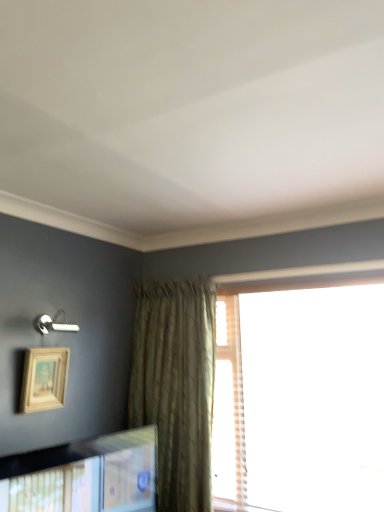
At what (x,y) coordinates should I click in order to perform the action: click on translucent plaid curtain at right. Please return your answer as a coordinate pair (x, y). Looking at the image, I should click on (300, 399).

Identify the location of wooden picture frame at lower left, which appears as the second picture frame when viewed from the top. (85, 475).

Based on their sizes in the image, would you say wooden picture frame at upper left, positioned as the first picture frame in top-to-bottom order, is bigger or smaller than wooden picture frame at lower left, which appears as the second picture frame when viewed from the top?

In the image, wooden picture frame at upper left, positioned as the first picture frame in top-to-bottom order, appears to be smaller than wooden picture frame at lower left, which appears as the second picture frame when viewed from the top.

Are wooden picture frame at upper left, positioned as the first picture frame in top-to-bottom order, and wooden picture frame at lower left, which appears as the second picture frame when viewed from the top, beside each other?

No, wooden picture frame at upper left, positioned as the first picture frame in top-to-bottom order, is not beside wooden picture frame at lower left, which appears as the second picture frame when viewed from the top.

Considering the positions of points (41, 381) and (93, 502), is point (41, 381) farther from camera compared to point (93, 502)?

Yes, it is.

Is wooden picture frame at upper left, positioned as the first picture frame in top-to-bottom order, shorter than wooden picture frame at lower left, the first picture frame when ordered from bottom to top?

Indeed, wooden picture frame at upper left, positioned as the first picture frame in top-to-bottom order, has a lesser height compared to wooden picture frame at lower left, the first picture frame when ordered from bottom to top.

Consider the image. Considering the sizes of objects wooden picture frame at lower left, the first picture frame when ordered from bottom to top, and wooden picture frame at upper left, which is the 2th picture frame in bottom-to-top order, in the image provided, who is smaller, wooden picture frame at lower left, the first picture frame when ordered from bottom to top, or wooden picture frame at upper left, which is the 2th picture frame in bottom-to-top order,?

Smaller between the two is wooden picture frame at upper left, which is the 2th picture frame in bottom-to-top order.

From the image's perspective, does wooden picture frame at lower left, the first picture frame when ordered from bottom to top, appear higher than wooden picture frame at upper left, which is the 2th picture frame in bottom-to-top order?

No, from the image's perspective, wooden picture frame at lower left, the first picture frame when ordered from bottom to top, is not on top of wooden picture frame at upper left, which is the 2th picture frame in bottom-to-top order.

How different are the orientations of wooden picture frame at lower left, which appears as the second picture frame when viewed from the top, and wooden picture frame at upper left, positioned as the first picture frame in top-to-bottom order, in degrees?

The facing directions of wooden picture frame at lower left, which appears as the second picture frame when viewed from the top, and wooden picture frame at upper left, positioned as the first picture frame in top-to-bottom order, are 9.48 degrees apart.

Between point (120, 439) and point (49, 351), which one is positioned in front?

Point (120, 439)

Is translucent plaid curtain at right oriented away from wooden picture frame at lower left, the first picture frame when ordered from bottom to top?

That's not correct — translucent plaid curtain at right is not looking away from wooden picture frame at lower left, the first picture frame when ordered from bottom to top.

Is point (222, 442) closer or farther from the camera than point (20, 490)?

Point (222, 442).

Is translucent plaid curtain at right next to wooden picture frame at lower left, the first picture frame when ordered from bottom to top, and touching it?

translucent plaid curtain at right and wooden picture frame at lower left, the first picture frame when ordered from bottom to top, are clearly separated.

Visually, is translucent plaid curtain at right positioned to the left or to the right of wooden picture frame at lower left, which appears as the second picture frame when viewed from the top?

Clearly, translucent plaid curtain at right is on the right of wooden picture frame at lower left, which appears as the second picture frame when viewed from the top, in the image.

How many degrees apart are the facing directions of translucent plaid curtain at right and wooden picture frame at upper left, which is the 2th picture frame in bottom-to-top order?

translucent plaid curtain at right and wooden picture frame at upper left, which is the 2th picture frame in bottom-to-top order, are facing 88 degrees away from each other.

Could you tell me if translucent plaid curtain at right is facing wooden picture frame at upper left, which is the 2th picture frame in bottom-to-top order?

No, translucent plaid curtain at right does not turn towards wooden picture frame at upper left, which is the 2th picture frame in bottom-to-top order.

How far apart are translucent plaid curtain at right and wooden picture frame at upper left, positioned as the first picture frame in top-to-bottom order?

The distance of translucent plaid curtain at right from wooden picture frame at upper left, positioned as the first picture frame in top-to-bottom order, is 1.38 meters.

Is the depth of translucent plaid curtain at right greater than that of wooden picture frame at upper left, positioned as the first picture frame in top-to-bottom order?

Yes, translucent plaid curtain at right is further from the viewer.

Is wooden picture frame at lower left, which appears as the second picture frame when viewed from the top, positioned with its back to translucent plaid curtain at right?

No, translucent plaid curtain at right is not at the back of wooden picture frame at lower left, which appears as the second picture frame when viewed from the top.

From a real-world perspective, is wooden picture frame at lower left, the first picture frame when ordered from bottom to top, above or below translucent plaid curtain at right?

wooden picture frame at lower left, the first picture frame when ordered from bottom to top, is below translucent plaid curtain at right.

Where is `window located on the right of wooden picture frame at lower left, the first picture frame when ordered from bottom to top`? This screenshot has width=384, height=512. window located on the right of wooden picture frame at lower left, the first picture frame when ordered from bottom to top is located at coordinates (300, 399).

Which of these two, wooden picture frame at lower left, the first picture frame when ordered from bottom to top, or translucent plaid curtain at right, is bigger?

With larger size is translucent plaid curtain at right.

From a real-world perspective, is wooden picture frame at upper left, positioned as the first picture frame in top-to-bottom order, positioned above or below translucent plaid curtain at right?

wooden picture frame at upper left, positioned as the first picture frame in top-to-bottom order, is above translucent plaid curtain at right.

In the scene shown: Considering the relative positions of wooden picture frame at upper left, positioned as the first picture frame in top-to-bottom order, and translucent plaid curtain at right in the image provided, is wooden picture frame at upper left, positioned as the first picture frame in top-to-bottom order, to the right of translucent plaid curtain at right from the viewer's perspective?

No.

Is wooden picture frame at upper left, which is the 2th picture frame in bottom-to-top order, positioned beyond the bounds of translucent plaid curtain at right?

That's correct, wooden picture frame at upper left, which is the 2th picture frame in bottom-to-top order, is outside of translucent plaid curtain at right.

Is wooden picture frame at upper left, positioned as the first picture frame in top-to-bottom order, positioned with its back to translucent plaid curtain at right?

No, wooden picture frame at upper left, positioned as the first picture frame in top-to-bottom order,'s orientation is not away from translucent plaid curtain at right.

Locate an element on the screen. This screenshot has height=512, width=384. picture frame in front of the wooden picture frame at upper left, which is the 2th picture frame in bottom-to-top order is located at coordinates (85, 475).

You are a GUI agent. You are given a task and a screenshot of the screen. Output one action in this format:
    pyautogui.click(x=<x>, y=<y>)
    Task: Click on the picture frame above the wooden picture frame at lower left, which appears as the second picture frame when viewed from the top (from a real-world perspective)
    The height and width of the screenshot is (512, 384).
    Given the screenshot: What is the action you would take?
    pyautogui.click(x=44, y=379)

Looking at the image, which one is located further to translucent plaid curtain at right, wooden picture frame at upper left, positioned as the first picture frame in top-to-bottom order, or wooden picture frame at lower left, which appears as the second picture frame when viewed from the top?

wooden picture frame at upper left, positioned as the first picture frame in top-to-bottom order, is positioned further to the anchor translucent plaid curtain at right.

When comparing their distances from wooden picture frame at upper left, positioned as the first picture frame in top-to-bottom order, does translucent plaid curtain at right or wooden picture frame at lower left, the first picture frame when ordered from bottom to top, seem closer?

Based on the image, wooden picture frame at lower left, the first picture frame when ordered from bottom to top, appears to be nearer to wooden picture frame at upper left, positioned as the first picture frame in top-to-bottom order.

From the image, which object appears to be farther from translucent plaid curtain at right, wooden picture frame at lower left, the first picture frame when ordered from bottom to top, or wooden picture frame at upper left, positioned as the first picture frame in top-to-bottom order?

The object further to translucent plaid curtain at right is wooden picture frame at upper left, positioned as the first picture frame in top-to-bottom order.

Considering their positions, is wooden picture frame at lower left, the first picture frame when ordered from bottom to top, positioned further to wooden picture frame at upper left, positioned as the first picture frame in top-to-bottom order, than translucent plaid curtain at right?

Among the two, translucent plaid curtain at right is located further to wooden picture frame at upper left, positioned as the first picture frame in top-to-bottom order.

Considering their positions, is translucent plaid curtain at right positioned closer to wooden picture frame at lower left, the first picture frame when ordered from bottom to top, than wooden picture frame at upper left, positioned as the first picture frame in top-to-bottom order?

Based on the image, wooden picture frame at upper left, positioned as the first picture frame in top-to-bottom order, appears to be nearer to wooden picture frame at lower left, the first picture frame when ordered from bottom to top.

Based on their spatial positions, is wooden picture frame at upper left, positioned as the first picture frame in top-to-bottom order, or translucent plaid curtain at right closer to wooden picture frame at lower left, which appears as the second picture frame when viewed from the top?

The object closer to wooden picture frame at lower left, which appears as the second picture frame when viewed from the top, is wooden picture frame at upper left, positioned as the first picture frame in top-to-bottom order.

The image size is (384, 512). Identify the location of picture frame between wooden picture frame at upper left, positioned as the first picture frame in top-to-bottom order, and translucent plaid curtain at right, in the horizontal direction. (85, 475).